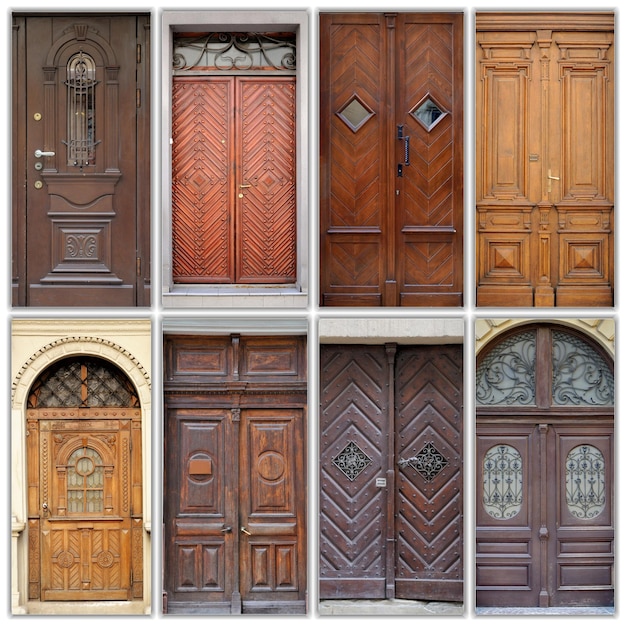
I want to click on door handles, so click(x=39, y=153), click(x=244, y=183), click(x=401, y=145), click(x=553, y=172), click(x=403, y=459), click(x=242, y=526), click(x=220, y=525), click(x=44, y=508).